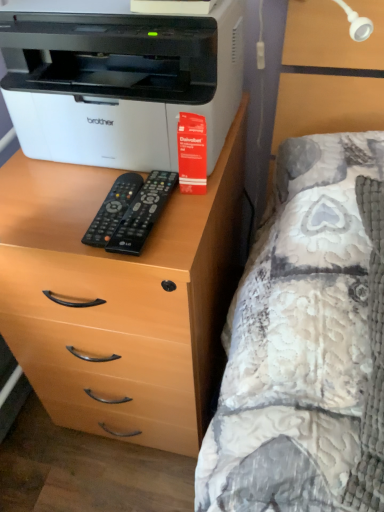
Measure the distance between fluffy quilted bed at right and camera.

The depth of fluffy quilted bed at right is 22.22 inches.

The image size is (384, 512). Find the location of `fluffy quilted bed at right`. fluffy quilted bed at right is located at coordinates (297, 339).

This screenshot has width=384, height=512. What do you see at coordinates (118, 80) in the screenshot?
I see `white plastic printer at upper left` at bounding box center [118, 80].

In order to face white plastic printer at upper left, should I rotate leftwards or rightwards?

Rotate your view left by about 5.822°.

Measure the distance between black plastic remote at center, the second remote viewed from the left, and camera.

black plastic remote at center, the second remote viewed from the left, is 24.59 inches away from camera.

This screenshot has height=512, width=384. In order to click on light brown wood chest of drawers at left in this screenshot , I will do `click(120, 298)`.

From the image's perspective, who appears lower, light brown wood chest of drawers at left or black plastic remote at center, arranged as the first remote when viewed from the left?

light brown wood chest of drawers at left is shown below in the image.

Is black plastic remote at center, arranged as the first remote when viewed from the left, surrounded by light brown wood chest of drawers at left?

No, black plastic remote at center, arranged as the first remote when viewed from the left, is not surrounded by light brown wood chest of drawers at left.

Considering the relative positions of light brown wood chest of drawers at left and black plastic remote at center, arranged as the first remote when viewed from the left, in the image provided, is light brown wood chest of drawers at left behind black plastic remote at center, arranged as the first remote when viewed from the left,?

No, it is in front of black plastic remote at center, arranged as the first remote when viewed from the left.

Would you say light brown wood chest of drawers at left is a long distance from black plastic remote at center, arranged as the first remote when viewed from the left?

No, light brown wood chest of drawers at left is in close proximity to black plastic remote at center, arranged as the first remote when viewed from the left.

Is light brown wood chest of drawers at left smaller than black plastic remote at center, the second remote viewed from the left?

Actually, light brown wood chest of drawers at left might be larger than black plastic remote at center, the second remote viewed from the left.

Considering the relative sizes of light brown wood chest of drawers at left and black plastic remote at center, the first remote when ordered from right to left, in the image provided, is light brown wood chest of drawers at left thinner than black plastic remote at center, the first remote when ordered from right to left,?

No.

From a real-world perspective, does light brown wood chest of drawers at left stand above black plastic remote at center, the first remote when ordered from right to left?

No, from a real-world perspective, light brown wood chest of drawers at left is not over black plastic remote at center, the first remote when ordered from right to left

Considering the positions of objects light brown wood chest of drawers at left and black plastic remote at center, the first remote when ordered from right to left, in the image provided, who is more to the right, light brown wood chest of drawers at left or black plastic remote at center, the first remote when ordered from right to left,?

black plastic remote at center, the first remote when ordered from right to left, is more to the right.

Can you confirm if white plastic printer at upper left is bigger than fluffy quilted bed at right?

No.

Does point (213, 93) come farther from viewer compared to point (252, 457)?

That is True.

From a real-world perspective, which object rests below the other?

fluffy quilted bed at right is physically lower.

From the image's perspective, who appears lower, white plastic printer at upper left or fluffy quilted bed at right?

fluffy quilted bed at right is shown below in the image.

In the scene shown: Which point is more forward, (141, 241) or (132, 21)?

The point (141, 241) is closer.

From the image's perspective, is black plastic remote at center, the first remote when ordered from right to left, located beneath white plastic printer at upper left?

Correct, black plastic remote at center, the first remote when ordered from right to left, appears lower than white plastic printer at upper left in the image.

Is black plastic remote at center, the second remote viewed from the left, to the left or to the right of white plastic printer at upper left in the image?

From the image, it's evident that black plastic remote at center, the second remote viewed from the left, is to the right of white plastic printer at upper left.

Where is `printer positioned vertically above the black plastic remote at center, the first remote when ordered from right to left (from a real-world perspective)`? The image size is (384, 512). printer positioned vertically above the black plastic remote at center, the first remote when ordered from right to left (from a real-world perspective) is located at coordinates (118, 80).

Which object is further away from the camera taking this photo, light brown wood chest of drawers at left or white plastic printer at upper left?

light brown wood chest of drawers at left is further away from the camera.

Can you confirm if light brown wood chest of drawers at left is bigger than white plastic printer at upper left?

Indeed, light brown wood chest of drawers at left has a larger size compared to white plastic printer at upper left.

Which of these two, light brown wood chest of drawers at left or white plastic printer at upper left, stands taller?

light brown wood chest of drawers at left.

Can you confirm if light brown wood chest of drawers at left is positioned to the right of white plastic printer at upper left?

No, light brown wood chest of drawers at left is not to the right of white plastic printer at upper left.

Identify the location of bed on the right of light brown wood chest of drawers at left. The image size is (384, 512). (297, 339).

Is fluffy quilted bed at right next to light brown wood chest of drawers at left?

They are not placed beside each other.

Which is more to the left, fluffy quilted bed at right or light brown wood chest of drawers at left?

Positioned to the left is light brown wood chest of drawers at left.

From a real-world perspective, is fluffy quilted bed at right over light brown wood chest of drawers at left?

Indeed, from a real-world perspective, fluffy quilted bed at right stands above light brown wood chest of drawers at left.

Is light brown wood chest of drawers at left surrounded by black plastic remote at center, the second remote viewed from the left?

No, light brown wood chest of drawers at left is not inside black plastic remote at center, the second remote viewed from the left.

From a real-world perspective, is black plastic remote at center, the second remote viewed from the left, located higher than light brown wood chest of drawers at left?

Correct, in the physical world, black plastic remote at center, the second remote viewed from the left, is higher than light brown wood chest of drawers at left.

Consider the image. From the image's perspective, is black plastic remote at center, the first remote when ordered from right to left, beneath light brown wood chest of drawers at left?

No, from the image's perspective, black plastic remote at center, the first remote when ordered from right to left, is not beneath light brown wood chest of drawers at left.

The width and height of the screenshot is (384, 512). Find the location of `the chest of drawers directly beneath the black plastic remote at center, arranged as the second remote when viewed from the right (from a real-world perspective)`. the chest of drawers directly beneath the black plastic remote at center, arranged as the second remote when viewed from the right (from a real-world perspective) is located at coordinates 120,298.

Image resolution: width=384 pixels, height=512 pixels. Identify the location of the 2nd remote positioned above the light brown wood chest of drawers at left (from a real-world perspective). (143, 213).

Looking at the image, which one is located further to fluffy quilted bed at right, black plastic remote at center, the second remote viewed from the left, or black plastic remote at center, arranged as the first remote when viewed from the left?

Based on the image, black plastic remote at center, arranged as the first remote when viewed from the left, appears to be further to fluffy quilted bed at right.

Considering their positions, is black plastic remote at center, arranged as the first remote when viewed from the left, positioned further to fluffy quilted bed at right than black plastic remote at center, the second remote viewed from the left?

The object further to fluffy quilted bed at right is black plastic remote at center, arranged as the first remote when viewed from the left.

Estimate the real-world distances between objects in this image. Which object is closer to white plastic printer at upper left, black plastic remote at center, the first remote when ordered from right to left, or fluffy quilted bed at right?

Among the two, black plastic remote at center, the first remote when ordered from right to left, is located nearer to white plastic printer at upper left.

From the image, which object appears to be farther from white plastic printer at upper left, light brown wood chest of drawers at left or black plastic remote at center, arranged as the first remote when viewed from the left?

light brown wood chest of drawers at left is positioned further to the anchor white plastic printer at upper left.

Looking at the image, which one is located further to black plastic remote at center, arranged as the second remote when viewed from the right, white plastic printer at upper left or light brown wood chest of drawers at left?

Among the two, light brown wood chest of drawers at left is located further to black plastic remote at center, arranged as the second remote when viewed from the right.

Estimate the real-world distances between objects in this image. Which object is closer to light brown wood chest of drawers at left, fluffy quilted bed at right or black plastic remote at center, arranged as the second remote when viewed from the right?

fluffy quilted bed at right.

When comparing their distances from black plastic remote at center, arranged as the first remote when viewed from the left, does fluffy quilted bed at right or light brown wood chest of drawers at left seem closer?

Based on the image, light brown wood chest of drawers at left appears to be nearer to black plastic remote at center, arranged as the first remote when viewed from the left.

When comparing their distances from black plastic remote at center, the first remote when ordered from right to left, does fluffy quilted bed at right or light brown wood chest of drawers at left seem closer?

Among the two, fluffy quilted bed at right is located nearer to black plastic remote at center, the first remote when ordered from right to left.

Image resolution: width=384 pixels, height=512 pixels. Find the location of `the chest of drawers located between fluffy quilted bed at right and black plastic remote at center, the first remote when ordered from right to left, in the depth direction`. the chest of drawers located between fluffy quilted bed at right and black plastic remote at center, the first remote when ordered from right to left, in the depth direction is located at coordinates (120, 298).

You are a GUI agent. You are given a task and a screenshot of the screen. Output one action in this format:
    pyautogui.click(x=<x>, y=<y>)
    Task: Click on the printer between fluffy quilted bed at right and black plastic remote at center, arranged as the second remote when viewed from the right, in the front-back direction
    This screenshot has width=384, height=512.
    Given the screenshot: What is the action you would take?
    pyautogui.click(x=118, y=80)

The height and width of the screenshot is (512, 384). Identify the location of remote between black plastic remote at center, arranged as the second remote when viewed from the right, and light brown wood chest of drawers at left in the up-down direction. (143, 213).

At what (x,y) coordinates should I click in order to perform the action: click on chest of drawers between fluffy quilted bed at right and black plastic remote at center, arranged as the first remote when viewed from the left, from front to back. Please return your answer as a coordinate pair (x, y). The height and width of the screenshot is (512, 384). Looking at the image, I should click on (120, 298).